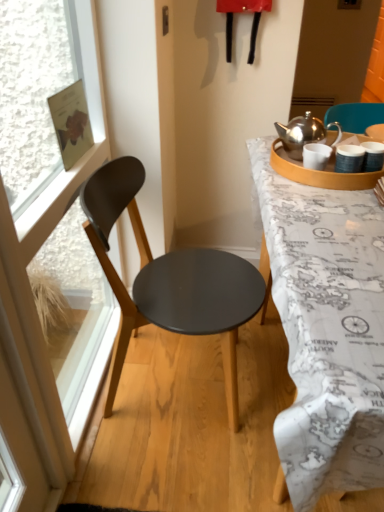
Question: Is white matte coffee cup at upper right facing towards white map-covered desk at right?

Choices:
 (A) yes
 (B) no

Answer: (B)

Question: Does white matte coffee cup at upper right have a greater height compared to white map-covered desk at right?

Choices:
 (A) yes
 (B) no

Answer: (B)

Question: Is white matte coffee cup at upper right not inside white map-covered desk at right?

Choices:
 (A) no
 (B) yes

Answer: (B)

Question: Considering the relative sizes of white matte coffee cup at upper right and white map-covered desk at right in the image provided, is white matte coffee cup at upper right thinner than white map-covered desk at right?

Choices:
 (A) yes
 (B) no

Answer: (A)

Question: Is white matte coffee cup at upper right placed right next to white map-covered desk at right?

Choices:
 (A) no
 (B) yes

Answer: (A)

Question: Based on their sizes in the image, would you say transparent glass window at left is bigger or smaller than matte black chair at left?

Choices:
 (A) big
 (B) small

Answer: (B)

Question: From their relative heights in the image, would you say transparent glass window at left is taller or shorter than matte black chair at left?

Choices:
 (A) short
 (B) tall

Answer: (B)

Question: Is transparent glass window at left in front of or behind matte black chair at left in the image?

Choices:
 (A) front
 (B) behind

Answer: (A)

Question: In terms of width, does transparent glass window at left look wider or thinner when compared to matte black chair at left?

Choices:
 (A) thin
 (B) wide

Answer: (A)

Question: Considering the positions of matte black chair at left and white map-covered desk at right in the image, is matte black chair at left taller or shorter than white map-covered desk at right?

Choices:
 (A) tall
 (B) short

Answer: (A)

Question: Is matte black chair at left in front of or behind white map-covered desk at right in the image?

Choices:
 (A) front
 (B) behind

Answer: (B)

Question: Is matte black chair at left spatially inside white map-covered desk at right, or outside of it?

Choices:
 (A) outside
 (B) inside

Answer: (A)

Question: From a real-world perspective, relative to white map-covered desk at right, is matte black chair at left vertically above or below?

Choices:
 (A) below
 (B) above

Answer: (B)

Question: Is point (168, 306) closer or farther from the camera than point (16, 190)?

Choices:
 (A) farther
 (B) closer

Answer: (A)

Question: Is matte black chair at left wider or thinner than transparent glass window at left?

Choices:
 (A) thin
 (B) wide

Answer: (B)